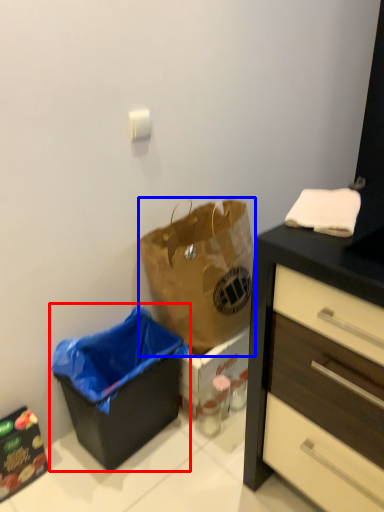
Question: Among these objects, which one is nearest to the camera, recycling bin (highlighted by a red box) or handbag (highlighted by a blue box)?

Choices:
 (A) recycling bin
 (B) handbag

Answer: (A)